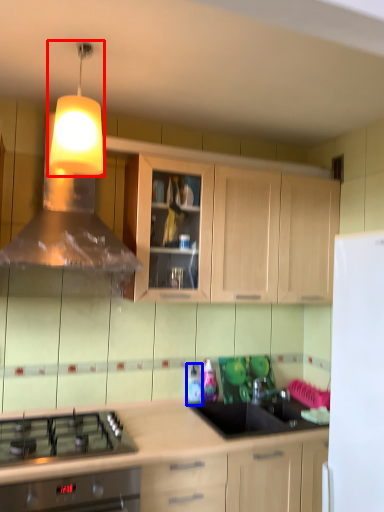
Question: Which object appears farthest to the camera in this image, light fixture (highlighted by a red box) or bottle (highlighted by a blue box)?

Choices:
 (A) light fixture
 (B) bottle

Answer: (B)